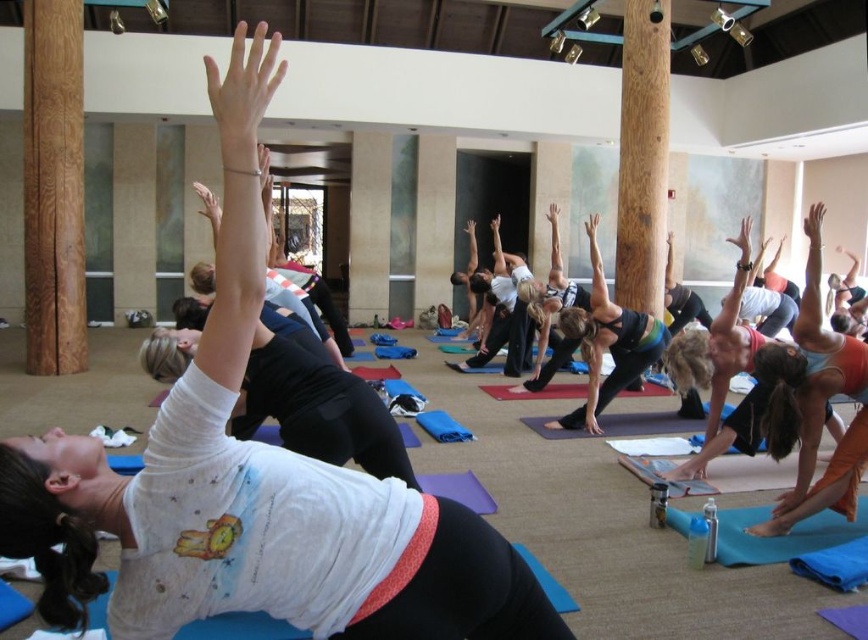
Does white matte yoga mat at center have a lesser height compared to blue fabric yoga mat at lower right?

No, white matte yoga mat at center is not shorter than blue fabric yoga mat at lower right.

Can you confirm if white matte yoga mat at center is thinner than blue fabric yoga mat at lower right?

Yes, white matte yoga mat at center is thinner than blue fabric yoga mat at lower right.

Which is in front, point (89, 532) or point (753, 552)?

Positioned in front is point (89, 532).

You are a GUI agent. You are given a task and a screenshot of the screen. Output one action in this format:
    pyautogui.click(x=<x>, y=<y>)
    Task: Click on the white matte yoga mat at center
    The width and height of the screenshot is (868, 640).
    Given the screenshot: What is the action you would take?
    pyautogui.click(x=253, y=483)